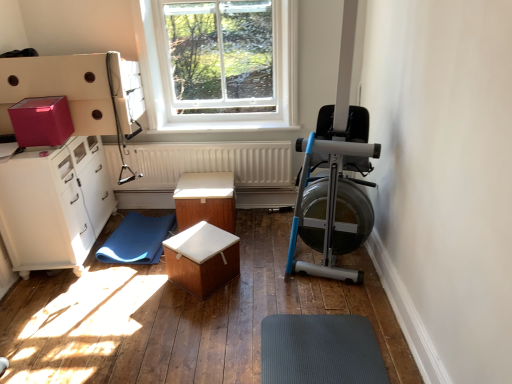
Question: Is wooden box at center, arranged as the second table when viewed from the back, in front of white textured radiator at center?

Choices:
 (A) yes
 (B) no

Answer: (A)

Question: Does wooden box at center, the first table in the front-to-back sequence, have a lesser width compared to white textured radiator at center?

Choices:
 (A) yes
 (B) no

Answer: (B)

Question: Is wooden box at center, the first table in the front-to-back sequence, facing away from white textured radiator at center?

Choices:
 (A) no
 (B) yes

Answer: (A)

Question: Is wooden box at center, the first table in the front-to-back sequence, at the left side of white textured radiator at center?

Choices:
 (A) no
 (B) yes

Answer: (A)

Question: Is wooden box at center, arranged as the second table when viewed from the back, not near white textured radiator at center?

Choices:
 (A) no
 (B) yes

Answer: (A)

Question: In terms of height, does wooden box at center, the first table in the front-to-back sequence, look taller or shorter compared to clear glass window at upper center?

Choices:
 (A) tall
 (B) short

Answer: (B)

Question: Would you say wooden box at center, arranged as the second table when viewed from the back, is to the left or to the right of clear glass window at upper center in the picture?

Choices:
 (A) right
 (B) left

Answer: (B)

Question: In terms of width, does wooden box at center, the first table in the front-to-back sequence, look wider or thinner when compared to clear glass window at upper center?

Choices:
 (A) wide
 (B) thin

Answer: (A)

Question: Is wooden box at center, arranged as the second table when viewed from the back, in front of or behind clear glass window at upper center in the image?

Choices:
 (A) behind
 (B) front

Answer: (B)

Question: Is wooden box at center, which is the first table from back to front, spatially inside wooden box at center, the first table in the front-to-back sequence, or outside of it?

Choices:
 (A) inside
 (B) outside

Answer: (B)

Question: In the image, is wooden box at center, the second table when ordered from front to back, positioned in front of or behind wooden box at center, arranged as the second table when viewed from the back?

Choices:
 (A) behind
 (B) front

Answer: (A)

Question: From a real-world perspective, relative to wooden box at center, arranged as the second table when viewed from the back, is wooden box at center, the second table when ordered from front to back, vertically above or below?

Choices:
 (A) below
 (B) above

Answer: (B)

Question: Is wooden box at center, the second table when ordered from front to back, wider or thinner than wooden box at center, the first table in the front-to-back sequence?

Choices:
 (A) thin
 (B) wide

Answer: (B)

Question: Considering the positions of point (266, 145) and point (222, 226), is point (266, 145) closer or farther from the camera than point (222, 226)?

Choices:
 (A) farther
 (B) closer

Answer: (A)

Question: Considering the positions of white textured radiator at center and wooden box at center, which is the first table from back to front, in the image, is white textured radiator at center taller or shorter than wooden box at center, which is the first table from back to front,?

Choices:
 (A) tall
 (B) short

Answer: (A)